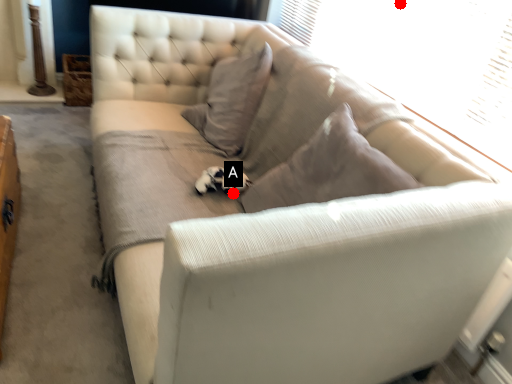
Question: Two points are circled on the image, labeled by A and B beside each circle. Which point appears farthest from the camera in this image?

Choices:
 (A) A is further
 (B) B is further

Answer: (B)